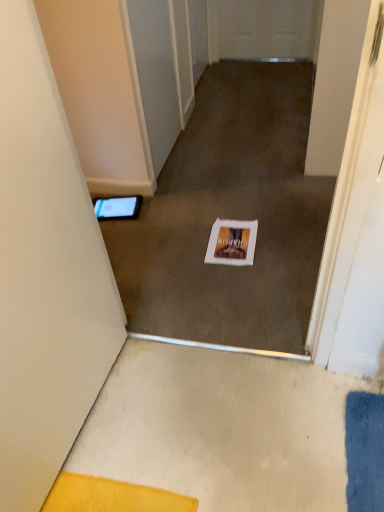
You are a GUI agent. You are given a task and a screenshot of the screen. Output one action in this format:
    pyautogui.click(x=<x>, y=<y>)
    Task: Click on the vacant space to the left of white paper at center
    
    Given the screenshot: What is the action you would take?
    pyautogui.click(x=177, y=249)